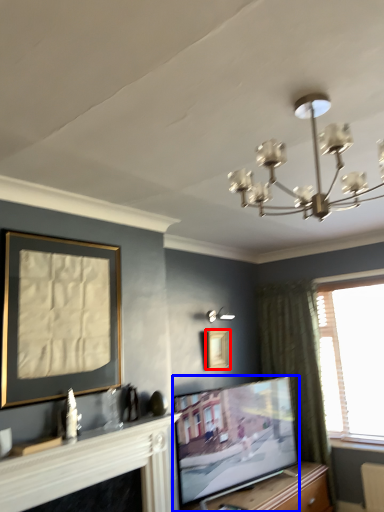
Question: Which of the following is the closest to the observer, picture frame (highlighted by a red box) or television (highlighted by a blue box)?

Choices:
 (A) picture frame
 (B) television

Answer: (B)